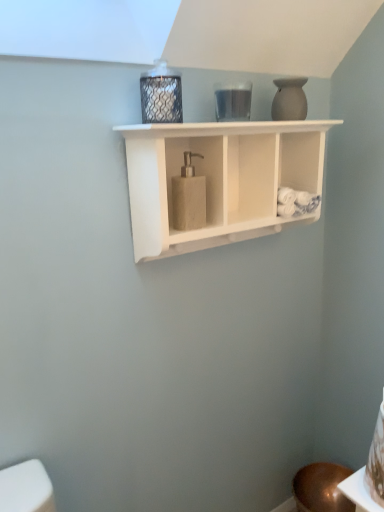
Identify the location of white matte soap dispenser at center. This screenshot has height=512, width=384. (220, 179).

What do you see at coordinates (188, 196) in the screenshot? The width and height of the screenshot is (384, 512). I see `beige textured soap dispenser at center` at bounding box center [188, 196].

This screenshot has width=384, height=512. I want to click on white matte soap dispenser at center, so click(220, 179).

Is white matte soap dispenser at center shorter than beige textured soap dispenser at center?

Incorrect, the height of white matte soap dispenser at center does not fall short of that of beige textured soap dispenser at center.

Where is `shelf lying in front of the beige textured soap dispenser at center`? Image resolution: width=384 pixels, height=512 pixels. shelf lying in front of the beige textured soap dispenser at center is located at coordinates (220, 179).

Considering the relative positions of white matte soap dispenser at center and beige textured soap dispenser at center in the image provided, is white matte soap dispenser at center to the left or to the right of beige textured soap dispenser at center?

From the image, it's evident that white matte soap dispenser at center is to the right of beige textured soap dispenser at center.

Is white matte soap dispenser at center in contact with matte white vase at upper right?

No, white matte soap dispenser at center is not touching matte white vase at upper right.

From a real-world perspective, which object stands above the other?

In real-world perspective, matte white vase at upper right is above.

Is white matte soap dispenser at center taller or shorter than matte white vase at upper right?

Clearly, white matte soap dispenser at center is taller compared to matte white vase at upper right.

Is matte white vase at upper right smaller than white matte soap dispenser at center?

Indeed, matte white vase at upper right has a smaller size compared to white matte soap dispenser at center.

Between matte white vase at upper right and white matte soap dispenser at center, which one has smaller width?

matte white vase at upper right.

Between matte white vase at upper right and white matte soap dispenser at center, which one appears on the right side from the viewer's perspective?

matte white vase at upper right is more to the right.

Considering the relative sizes of beige textured soap dispenser at center and white matte soap dispenser at center in the image provided, is beige textured soap dispenser at center bigger than white matte soap dispenser at center?

Actually, beige textured soap dispenser at center might be smaller than white matte soap dispenser at center.

Which point is more distant from viewer, [186,153] or [268,166]?

The point [268,166] is farther from the camera.

From the image's perspective, which one is positioned lower, beige textured soap dispenser at center or white matte soap dispenser at center?

beige textured soap dispenser at center.

Does matte white vase at upper right appear on the left side of beige textured soap dispenser at center?

Incorrect, matte white vase at upper right is not on the left side of beige textured soap dispenser at center.

Is point (303, 112) farther from viewer compared to point (181, 173)?

That is True.

The height and width of the screenshot is (512, 384). Find the location of `vase located above the beige textured soap dispenser at center (from the image's perspective)`. vase located above the beige textured soap dispenser at center (from the image's perspective) is located at coordinates (289, 100).

Is the depth of matte white vase at upper right greater than that of beige textured soap dispenser at center?

Yes, matte white vase at upper right is behind beige textured soap dispenser at center.

Which of these two, beige textured soap dispenser at center or matte white vase at upper right, stands taller?

beige textured soap dispenser at center is taller.

Is beige textured soap dispenser at center in contact with matte white vase at upper right?

No, beige textured soap dispenser at center is not beside matte white vase at upper right.

Is beige textured soap dispenser at center not inside matte white vase at upper right?

beige textured soap dispenser at center is positioned outside matte white vase at upper right.

How much distance is there between beige textured soap dispenser at center and matte white vase at upper right?

A distance of 12.13 inches exists between beige textured soap dispenser at center and matte white vase at upper right.

The height and width of the screenshot is (512, 384). I want to click on shelf below the beige textured soap dispenser at center (from a real-world perspective), so click(x=220, y=179).

Where is `shelf that appears on the left of matte white vase at upper right`? shelf that appears on the left of matte white vase at upper right is located at coordinates (220, 179).

When comparing their distances from matte white vase at upper right, does beige textured soap dispenser at center or white matte soap dispenser at center seem further?

Among the two, beige textured soap dispenser at center is located further to matte white vase at upper right.

Considering their positions, is beige textured soap dispenser at center positioned further to white matte soap dispenser at center than matte white vase at upper right?

matte white vase at upper right.

Based on their spatial positions, is matte white vase at upper right or beige textured soap dispenser at center further from white matte soap dispenser at center?

The object further to white matte soap dispenser at center is matte white vase at upper right.

From the image, which object appears to be farther from beige textured soap dispenser at center, white matte soap dispenser at center or matte white vase at upper right?

matte white vase at upper right is positioned further to the anchor beige textured soap dispenser at center.

Looking at the image, which one is located closer to beige textured soap dispenser at center, matte white vase at upper right or white matte soap dispenser at center?

The object closer to beige textured soap dispenser at center is white matte soap dispenser at center.

Which object lies nearer to the anchor point matte white vase at upper right, white matte soap dispenser at center or beige textured soap dispenser at center?

white matte soap dispenser at center is closer to matte white vase at upper right.

The width and height of the screenshot is (384, 512). Identify the location of shelf between matte white vase at upper right and beige textured soap dispenser at center in the vertical direction. coord(220,179).